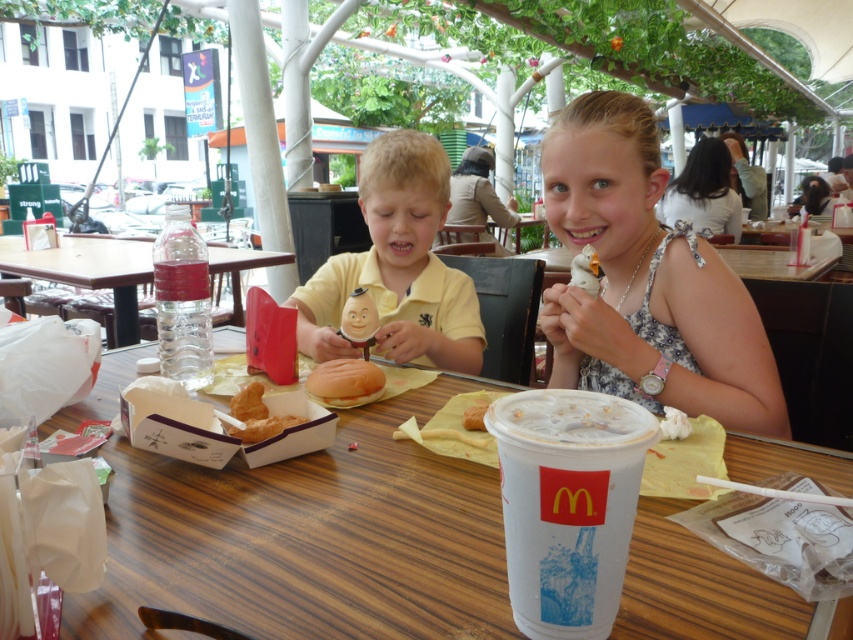
Who is taller, matte beige blouse at upper center or golden crispy bread at center?

Standing taller between the two is matte beige blouse at upper center.

Can you confirm if matte beige blouse at upper center is positioned to the left of golden crispy bread at center?

Incorrect, matte beige blouse at upper center is not on the left side of golden crispy bread at center.

This screenshot has height=640, width=853. Find the location of `matte beige blouse at upper center`. matte beige blouse at upper center is located at coordinates (477, 193).

Does point (224, 269) come in front of point (374, 376)?

No.

Which is in front, point (113, 237) or point (332, 387)?

Point (332, 387) is in front.

I want to click on clear plastic bottle at center, so click(x=88, y=269).

You are a GUI agent. You are given a task and a screenshot of the screen. Output one action in this format:
    pyautogui.click(x=<x>, y=<y>)
    Task: Click on the clear plastic bottle at center
    Image resolution: width=853 pixels, height=640 pixels.
    Given the screenshot: What is the action you would take?
    pyautogui.click(x=88, y=269)

Who is positioned more to the left, matte beige blouse at upper center or golden bread roll at center?

golden bread roll at center is more to the left.

Image resolution: width=853 pixels, height=640 pixels. I want to click on matte beige blouse at upper center, so click(477, 193).

The width and height of the screenshot is (853, 640). In order to click on matte beige blouse at upper center in this screenshot , I will do `click(477, 193)`.

At what (x,y) coordinates should I click in order to perform the action: click on matte beige blouse at upper center. Please return your answer as a coordinate pair (x, y). The height and width of the screenshot is (640, 853). Looking at the image, I should click on tap(477, 193).